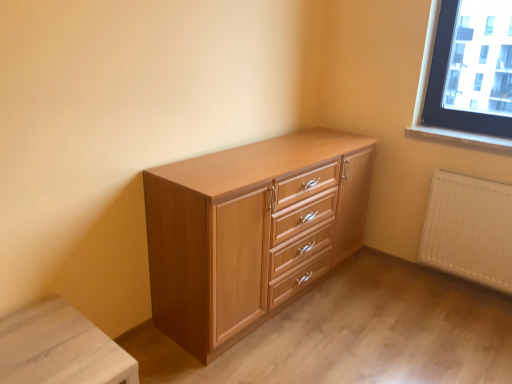
Locate an element on the screen. The width and height of the screenshot is (512, 384). blank space situated above light wood changing table at lower left (from a real-world perspective) is located at coordinates (51, 347).